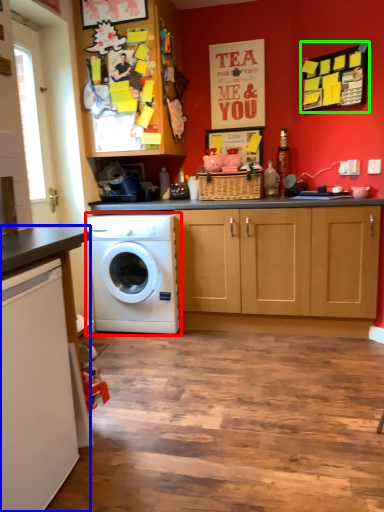
Question: Based on their relative distances, which object is nearer to washing machine (highlighted by a red box)? Choose from countertop (highlighted by a blue box) and bulletin board (highlighted by a green box).

Choices:
 (A) countertop
 (B) bulletin board

Answer: (A)